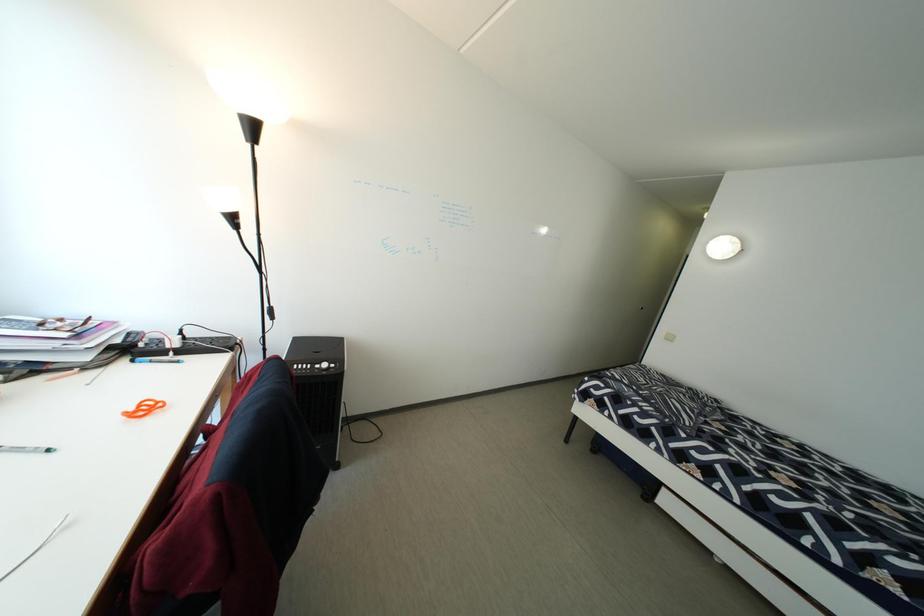
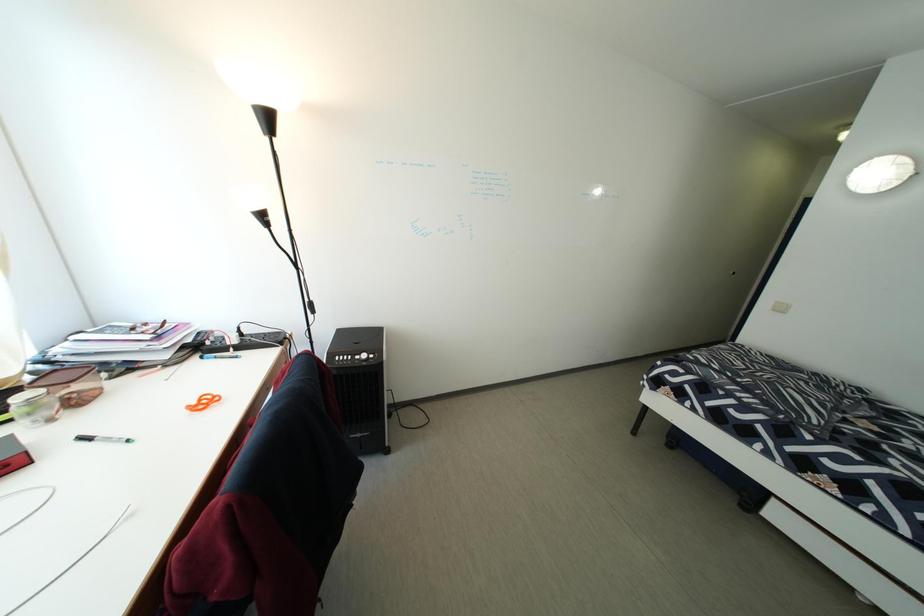
Question: The images are taken continuously from a first-person perspective. In which direction is your viewpoint rotating?

Choices:
 (A) Left
 (B) Right
 (C) Up
 (D) Down

Answer: (A)